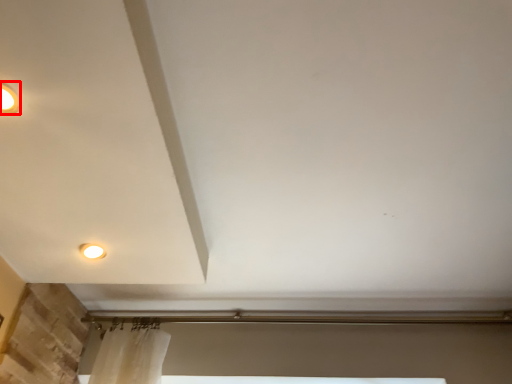
Question: In this image, where is lighting (annotated by the red box) located relative to lamp?

Choices:
 (A) right
 (B) left

Answer: (B)